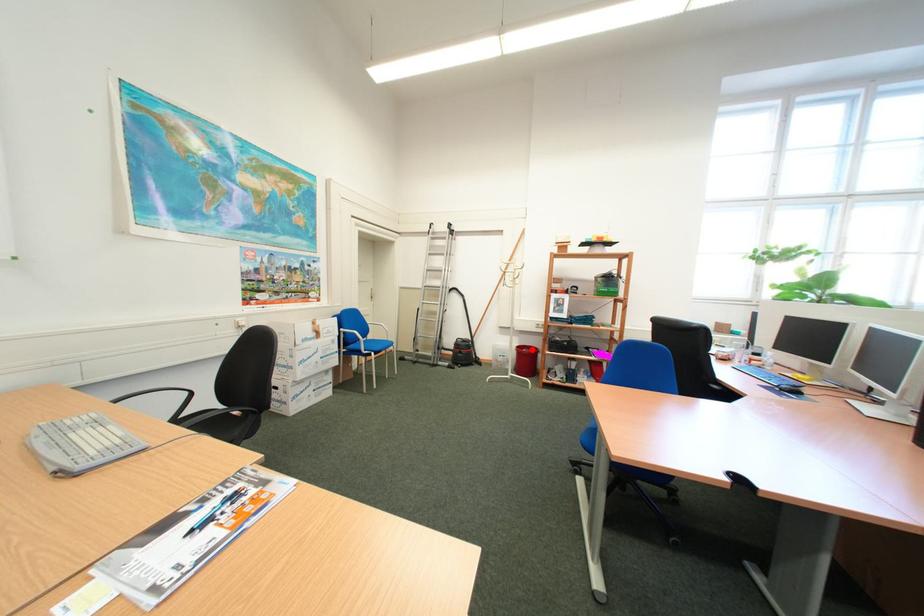
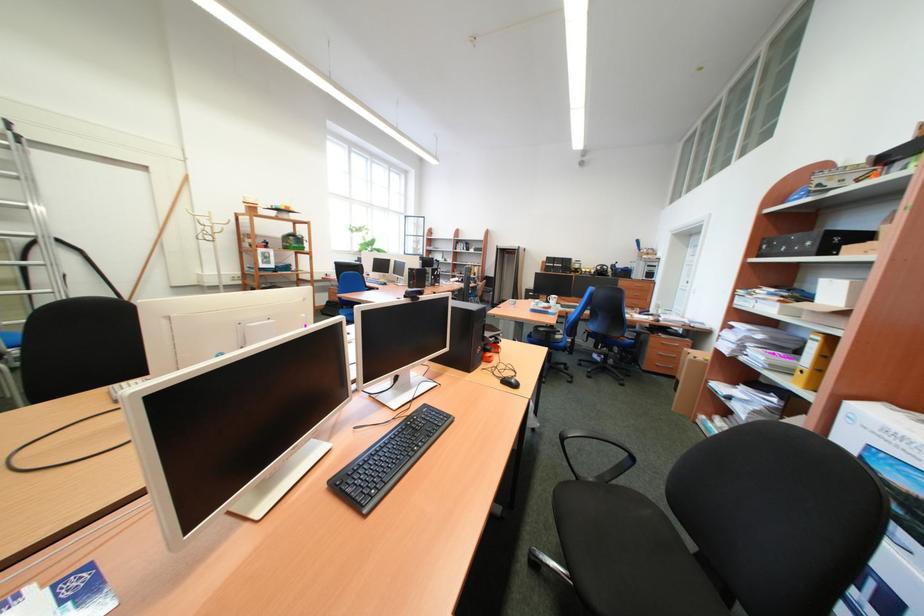
Question: I am providing you with two images of the same scene from different viewpoints. A red point is marked on the first image. At the location where the point appears in image 1, is it still visible in image 2?

Choices:
 (A) Yes
 (B) No

Answer: (B)